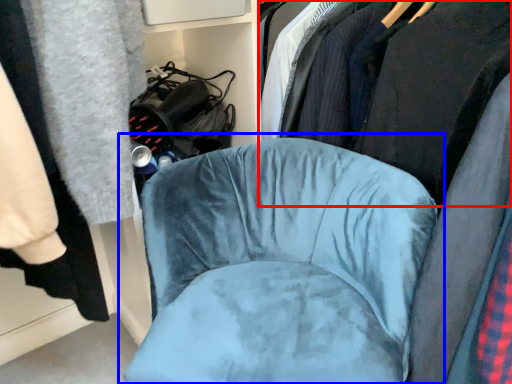
Question: Which point is closer to the camera, clothing (highlighted by a red box) or chair (highlighted by a blue box)?

Choices:
 (A) clothing
 (B) chair

Answer: (B)